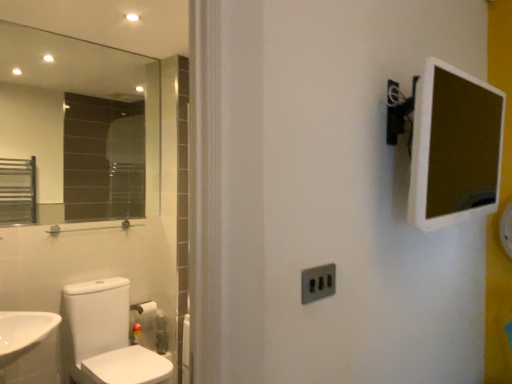
Question: Can you confirm if satin silver switch at center is positioned to the right of white glossy toilet at lower left?

Choices:
 (A) yes
 (B) no

Answer: (A)

Question: Is satin silver switch at center further to the viewer compared to white glossy toilet at lower left?

Choices:
 (A) yes
 (B) no

Answer: (B)

Question: From a real-world perspective, is satin silver switch at center positioned under white glossy toilet at lower left based on gravity?

Choices:
 (A) no
 (B) yes

Answer: (A)

Question: From the image's perspective, is satin silver switch at center on top of white glossy toilet at lower left?

Choices:
 (A) no
 (B) yes

Answer: (B)

Question: Does satin silver switch at center have a greater height compared to white glossy toilet at lower left?

Choices:
 (A) yes
 (B) no

Answer: (B)

Question: From a real-world perspective, is satin silver switch at center physically located above or below clear glass mirror at upper left?

Choices:
 (A) below
 (B) above

Answer: (A)

Question: From the image's perspective, is satin silver switch at center located above or below clear glass mirror at upper left?

Choices:
 (A) below
 (B) above

Answer: (A)

Question: Considering the positions of satin silver switch at center and clear glass mirror at upper left in the image, is satin silver switch at center taller or shorter than clear glass mirror at upper left?

Choices:
 (A) short
 (B) tall

Answer: (A)

Question: Considering the positions of satin silver switch at center and clear glass mirror at upper left in the image, is satin silver switch at center wider or thinner than clear glass mirror at upper left?

Choices:
 (A) thin
 (B) wide

Answer: (A)

Question: From the image's perspective, is white plastic mirror at upper right located above or below clear glass mirror at upper left?

Choices:
 (A) above
 (B) below

Answer: (B)

Question: Based on their positions, is white plastic mirror at upper right located to the left or right of clear glass mirror at upper left?

Choices:
 (A) left
 (B) right

Answer: (B)

Question: Which is correct: white plastic mirror at upper right is inside clear glass mirror at upper left, or outside of it?

Choices:
 (A) inside
 (B) outside

Answer: (B)

Question: Is white plastic mirror at upper right bigger or smaller than clear glass mirror at upper left?

Choices:
 (A) small
 (B) big

Answer: (B)

Question: In the image, is white glossy toilet at lower left positioned in front of or behind clear glass mirror at upper left?

Choices:
 (A) behind
 (B) front

Answer: (B)

Question: From the image's perspective, is white glossy toilet at lower left positioned above or below clear glass mirror at upper left?

Choices:
 (A) below
 (B) above

Answer: (A)